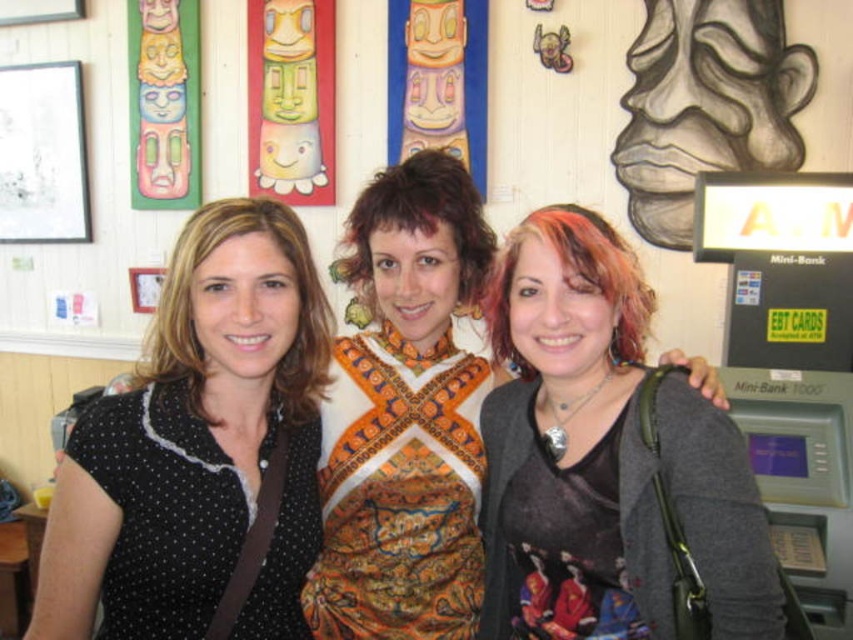
Question: Is black dotted shirt at left below printed fabric scarf at center?

Choices:
 (A) no
 (B) yes

Answer: (B)

Question: Which object appears farthest from the camera in this image?

Choices:
 (A) black dotted shirt at left
 (B) matte black purse at center

Answer: (B)

Question: Is black dotted shirt at left to the right of printed fabric scarf at center from the viewer's perspective?

Choices:
 (A) no
 (B) yes

Answer: (A)

Question: Which object is positioned closest to the matte black purse at center?

Choices:
 (A) printed fabric scarf at center
 (B) black dotted shirt at left

Answer: (A)

Question: Does matte black purse at center appear over black dotted shirt at left?

Choices:
 (A) no
 (B) yes

Answer: (A)

Question: Estimate the real-world distances between objects in this image. Which object is farther from the printed fabric scarf at center?

Choices:
 (A) matte black purse at center
 (B) black dotted shirt at left

Answer: (B)